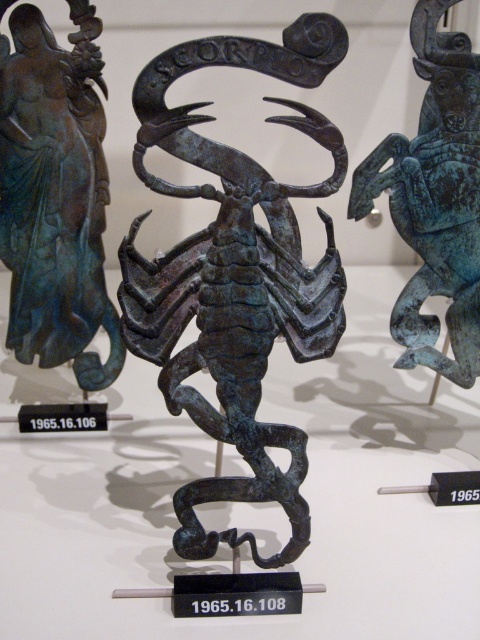
You are a museum curator examining the layout of the exhibition space. The bronze scorpion at center is represented by point (236, 275). Where exactly is the bronze scorpion located in the image?

The bronze scorpion at center is located at the coordinates point (236, 275).

You are standing in front of the bronze scorpion sculpture. There are two points on the sculpture labeled as point (288, 72) and point (17, 108). Which point is closer to you?

Point (288, 72) is closer to the viewer than point (17, 108).